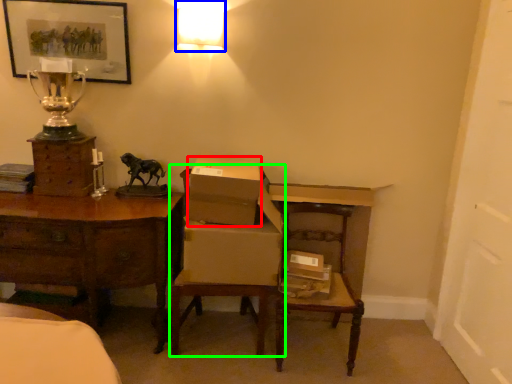
Question: Which object is positioned farthest from cardboard box (highlighted by a red box)? Select from lamp (highlighted by a blue box) and armchair (highlighted by a green box).

Choices:
 (A) lamp
 (B) armchair

Answer: (A)